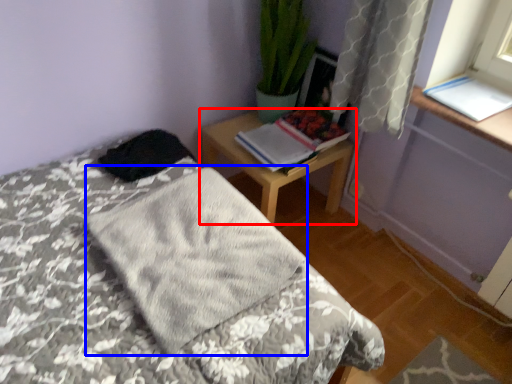
Question: Which object is closer to the camera taking this photo, nightstand (highlighted by a red box) or blanket (highlighted by a blue box)?

Choices:
 (A) nightstand
 (B) blanket

Answer: (B)